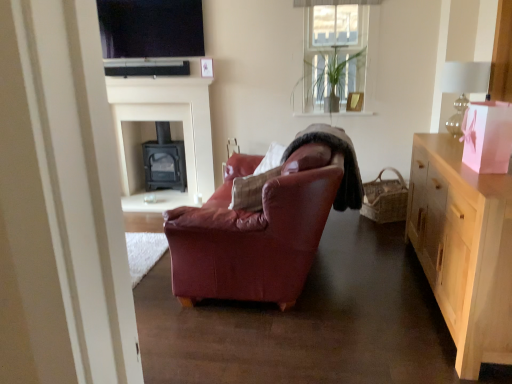
What do you see at coordinates (464, 248) in the screenshot? I see `light wood cabinet at right` at bounding box center [464, 248].

What is the approximate width of black matte fireplace at center, the 1th fireplace positioned from the back?

black matte fireplace at center, the 1th fireplace positioned from the back, is 35.98 centimeters in width.

What do you see at coordinates (385, 198) in the screenshot? The height and width of the screenshot is (384, 512). I see `woven brown picnic basket at right` at bounding box center [385, 198].

This screenshot has height=384, width=512. What do you see at coordinates (167, 120) in the screenshot?
I see `black matte fireplace at center, which is the first fireplace from front to back` at bounding box center [167, 120].

Describe the element at coordinates (151, 28) in the screenshot. This screenshot has width=512, height=384. I see `matte black tv at upper center` at that location.

The height and width of the screenshot is (384, 512). I want to click on light wood cabinet at right, so click(x=464, y=248).

At what (x,y) coordinates should I click in order to perform the action: click on television that appears above the clear glass lampshade at upper right (from a real-world perspective). Please return your answer as a coordinate pair (x, y). The width and height of the screenshot is (512, 384). Looking at the image, I should click on (151, 28).

Which object is wider, clear glass lampshade at upper right or matte black tv at upper center?

clear glass lampshade at upper right.

How different are the orientations of clear glass lampshade at upper right and matte black tv at upper center in degrees?

The facing directions of clear glass lampshade at upper right and matte black tv at upper center are 89.2 degrees apart.

From the image's perspective, is clear glass lampshade at upper right beneath matte black tv at upper center?

Yes.

Is point (187, 76) positioned in front of point (162, 109)?

Yes.

From a real-world perspective, is matte black tv at upper center physically above black matte fireplace at center, which is the first fireplace from front to back?

Yes.

Is matte black tv at upper center touching black matte fireplace at center, which is the first fireplace from front to back?

matte black tv at upper center and black matte fireplace at center, which is the first fireplace from front to back, are not in contact.

Is clear glass lampshade at upper right located within green glossy plant at upper center?

No, green glossy plant at upper center does not contain clear glass lampshade at upper right.

Consider the image. Between green glossy plant at upper center and clear glass lampshade at upper right, which one appears on the left side from the viewer's perspective?

green glossy plant at upper center is more to the left.

Does green glossy plant at upper center turn towards clear glass lampshade at upper right?

No.

Is green glossy plant at upper center positioned far away from clear glass lampshade at upper right?

Yes.

Which of these two, black matte fireplace at center, acting as the 2th fireplace starting from the back, or black matte soundbar at upper center, is wider?

black matte soundbar at upper center is wider.

Looking at this image, is black matte fireplace at center, which is the first fireplace from front to back, not inside black matte soundbar at upper center?

Yes.

Considering the relative sizes of black matte fireplace at center, acting as the 2th fireplace starting from the back, and black matte soundbar at upper center in the image provided, is black matte fireplace at center, acting as the 2th fireplace starting from the back, smaller than black matte soundbar at upper center?

No, black matte fireplace at center, acting as the 2th fireplace starting from the back, is not smaller than black matte soundbar at upper center.

From a real-world perspective, which object rests below the other?

black matte fireplace at center, which is the first fireplace from front to back.

From the image's perspective, is matte black tv at upper center above or below green glossy plant at upper center?

From the image's perspective, matte black tv at upper center appears above green glossy plant at upper center.

Does matte black tv at upper center have a smaller size compared to green glossy plant at upper center?

Yes, matte black tv at upper center is smaller than green glossy plant at upper center.

Is matte black tv at upper center touching green glossy plant at upper center?

There is a gap between matte black tv at upper center and green glossy plant at upper center.

Would you say green glossy plant at upper center is part of matte black tv at upper center's contents?

That's incorrect, green glossy plant at upper center is not inside matte black tv at upper center.

Considering the relative sizes of black matte fireplace at center, marked as the 2th fireplace in a front-to-back arrangement, and black matte soundbar at upper center in the image provided, is black matte fireplace at center, marked as the 2th fireplace in a front-to-back arrangement, thinner than black matte soundbar at upper center?

No.

Based on their sizes in the image, would you say black matte fireplace at center, the 1th fireplace positioned from the back, is bigger or smaller than black matte soundbar at upper center?

Clearly, black matte fireplace at center, the 1th fireplace positioned from the back, is larger in size than black matte soundbar at upper center.

Which of these two, black matte fireplace at center, the 1th fireplace positioned from the back, or black matte soundbar at upper center, stands shorter?

black matte soundbar at upper center.

Can you see black matte fireplace at center, the 1th fireplace positioned from the back, touching black matte soundbar at upper center?

black matte fireplace at center, the 1th fireplace positioned from the back, and black matte soundbar at upper center are not in contact.

Looking at this image, is black matte soundbar at upper center surrounded by matte black tv at upper center?

No, black matte soundbar at upper center is not surrounded by matte black tv at upper center.

Is matte black tv at upper center touching black matte soundbar at upper center?

Yes.

Who is taller, matte black tv at upper center or black matte soundbar at upper center?

Standing taller between the two is black matte soundbar at upper center.

You are a GUI agent. You are given a task and a screenshot of the screen. Output one action in this format:
    pyautogui.click(x=<x>, y=<y>)
    Task: Click on the lamp below the matte black tv at upper center (from the image's perspective)
    
    Given the screenshot: What is the action you would take?
    pyautogui.click(x=463, y=87)

Where is `mantle lying above the black matte fireplace at center, which is the first fireplace from front to back (from the image's perspective)`? The height and width of the screenshot is (384, 512). mantle lying above the black matte fireplace at center, which is the first fireplace from front to back (from the image's perspective) is located at coordinates (157, 81).

Based on their spatial positions, is black matte fireplace at center, the 1th fireplace positioned from the back, or green glossy plant at upper center closer to matte black tv at upper center?

Among the two, black matte fireplace at center, the 1th fireplace positioned from the back, is located nearer to matte black tv at upper center.

Which object lies further to the anchor point black matte soundbar at upper center, matte black tv at upper center or black matte fireplace at center, which is the first fireplace from front to back?

black matte fireplace at center, which is the first fireplace from front to back, lies further to black matte soundbar at upper center than the other object.

Considering their positions, is woven brown picnic basket at right positioned closer to green glossy plant at upper center than clear glass lampshade at upper right?

Among the two, woven brown picnic basket at right is located nearer to green glossy plant at upper center.

Considering their positions, is black matte fireplace at center, marked as the 2th fireplace in a front-to-back arrangement, positioned further to black matte soundbar at upper center than black matte fireplace at center, acting as the 2th fireplace starting from the back?

Based on the image, black matte fireplace at center, marked as the 2th fireplace in a front-to-back arrangement, appears to be further to black matte soundbar at upper center.

From the image, which object appears to be nearer to black matte fireplace at center, marked as the 2th fireplace in a front-to-back arrangement, clear glass lampshade at upper right or green glossy plant at upper center?

green glossy plant at upper center.

Looking at the image, which one is located further to black matte fireplace at center, marked as the 2th fireplace in a front-to-back arrangement, light wood cabinet at right or woven brown picnic basket at right?

light wood cabinet at right.

Considering their positions, is woven brown picnic basket at right positioned closer to matte black tv at upper center than black matte fireplace at center, the 1th fireplace positioned from the back?

black matte fireplace at center, the 1th fireplace positioned from the back, is positioned closer to the anchor matte black tv at upper center.

Based on their spatial positions, is black matte soundbar at upper center or black matte fireplace at center, acting as the 2th fireplace starting from the back, further from black matte fireplace at center, the 1th fireplace positioned from the back?

Based on the image, black matte soundbar at upper center appears to be further to black matte fireplace at center, the 1th fireplace positioned from the back.

Locate an element on the screen. This screenshot has height=384, width=512. picnic basket between black matte fireplace at center, which is the first fireplace from front to back, and clear glass lampshade at upper right, in the horizontal direction is located at coordinates (385, 198).

The width and height of the screenshot is (512, 384). What are the coordinates of `houseplant between black matte soundbar at upper center and woven brown picnic basket at right in the horizontal direction` in the screenshot? It's located at (330, 79).

What are the coordinates of `television between matte black tv at upper center and clear glass lampshade at upper right` in the screenshot? It's located at (151, 28).

The image size is (512, 384). What are the coordinates of `cabinetry between matte black tv at upper center and clear glass lampshade at upper right in the horizontal direction` in the screenshot? It's located at (464, 248).